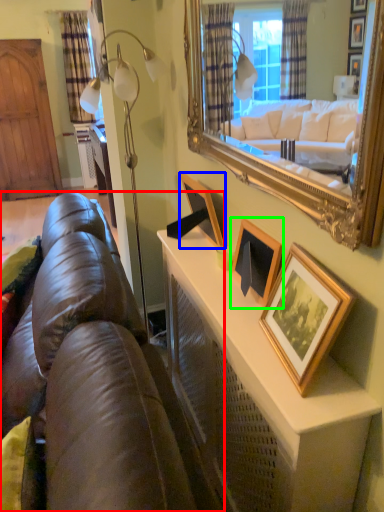
Question: Based on their relative distances, which object is farther from studio couch (highlighted by a red box)? Choose from picture frame (highlighted by a blue box) and picture frame (highlighted by a green box).

Choices:
 (A) picture frame
 (B) picture frame

Answer: (A)